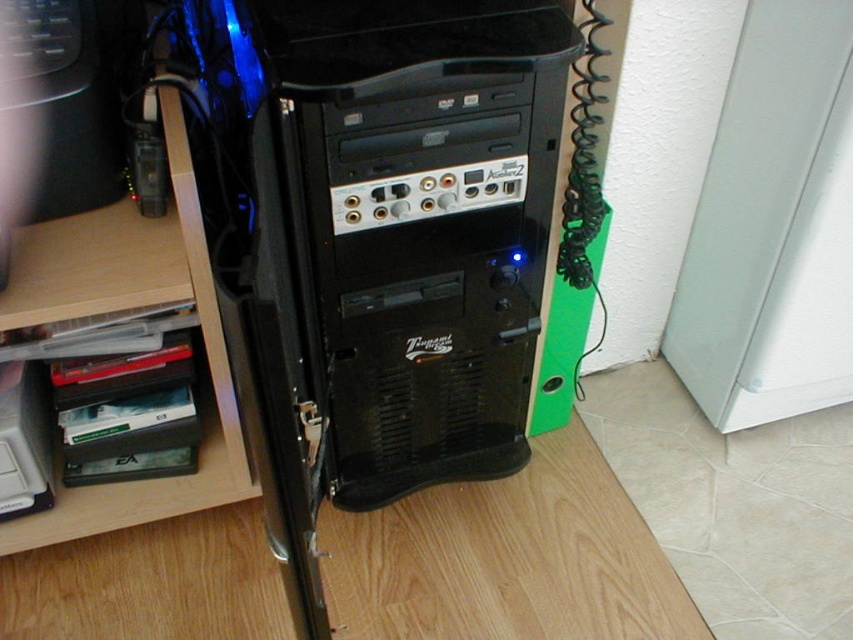
You are setting up a home office and need to place both the black plastic computer tower at center and the wooden at left on a desk. Given their sizes, which one should you place closer to the edge to prevent it from taking up too much space?

The wooden at left is smaller in size than the black plastic computer tower at center, so placing the wooden at left closer to the edge would help conserve space.

Based on the photo, you are standing in front of the computer tower and want to locate two points marked in the image. Which of the two points, point (376, 225) or point (80, 214), is closer to you?

Point (376, 225) is closer to the camera than point (80, 214).